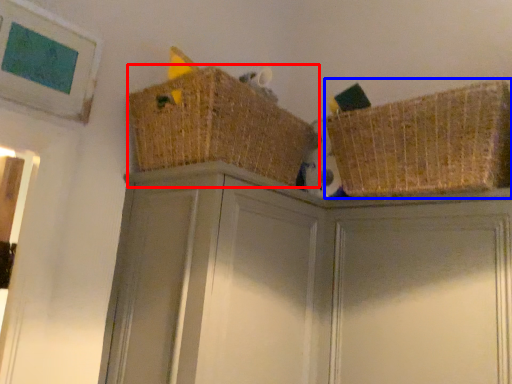
Question: Which object is further to the camera taking this photo, basket (highlighted by a red box) or basket (highlighted by a blue box)?

Choices:
 (A) basket
 (B) basket

Answer: (A)